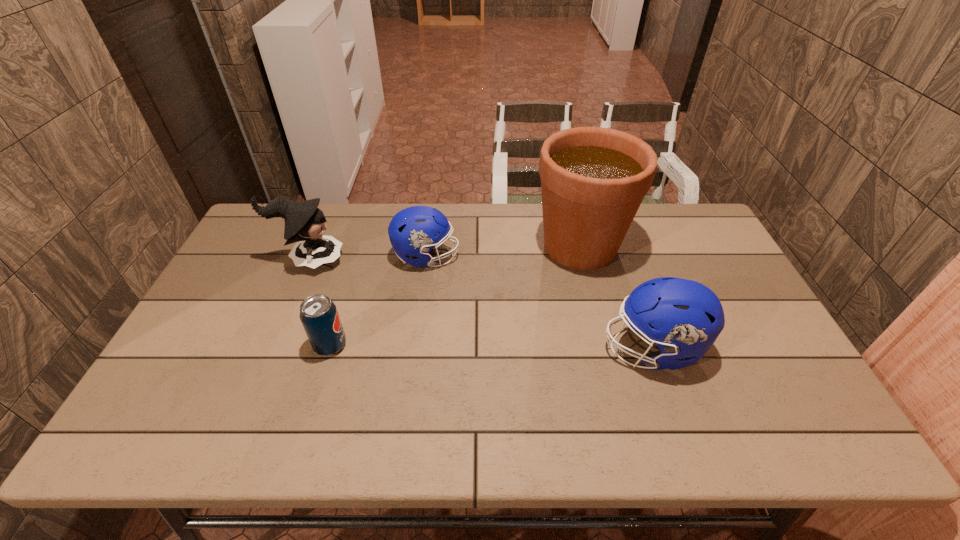
The width and height of the screenshot is (960, 540). I want to click on free space located 0.140m on the front-facing side of the taller football helmet, so click(x=548, y=348).

The width and height of the screenshot is (960, 540). I want to click on free location located on the front-facing side of the taller football helmet, so click(537, 348).

This screenshot has width=960, height=540. I want to click on free space located 0.140m on the face guard of the third object from left to right, so click(503, 257).

The image size is (960, 540). In order to click on free location located 0.180m on the right of the soda can in this screenshot , I will do `click(416, 345)`.

Locate an element on the screen. This screenshot has height=540, width=960. flowerpot that is at the far edge is located at coordinates (x=593, y=180).

Locate an element on the screen. doll at the far edge is located at coordinates (304, 221).

This screenshot has width=960, height=540. I want to click on football helmet that is positioned at the far edge, so click(x=413, y=231).

This screenshot has height=540, width=960. Identify the location of object at the left edge. (304, 221).

This screenshot has width=960, height=540. What are the coordinates of `object at the far left corner` in the screenshot? It's located at (304, 221).

In the image, there is a desktop. What are the coordinates of `vacant space at the far edge` in the screenshot? It's located at (481, 214).